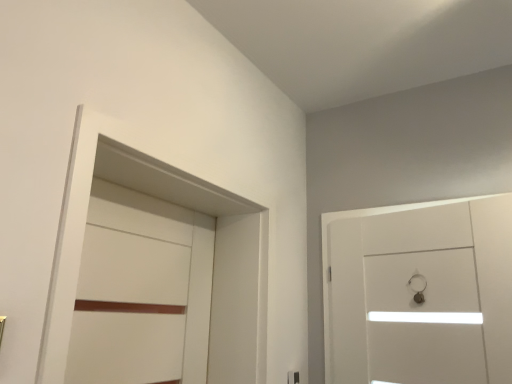
Question: Can you confirm if white glossy door at right, the 2th door in the left-to-right sequence, is bigger than white matte door at left, which ranks as the 1th door in left-to-right order?

Choices:
 (A) yes
 (B) no

Answer: (A)

Question: Can you confirm if white glossy door at right, the first door positioned from the right, is thinner than white matte door at left, arranged as the second door when viewed from the right?

Choices:
 (A) no
 (B) yes

Answer: (A)

Question: Considering the relative sizes of white glossy door at right, the first door positioned from the right, and white matte door at left, which ranks as the 1th door in left-to-right order, in the image provided, is white glossy door at right, the first door positioned from the right, wider than white matte door at left, which ranks as the 1th door in left-to-right order,?

Choices:
 (A) no
 (B) yes

Answer: (B)

Question: Is white glossy door at right, the 2th door in the left-to-right sequence, behind white matte door at left, which ranks as the 1th door in left-to-right order?

Choices:
 (A) yes
 (B) no

Answer: (A)

Question: From the image's perspective, is white glossy door at right, the 2th door in the left-to-right sequence, below white matte door at left, which ranks as the 1th door in left-to-right order?

Choices:
 (A) yes
 (B) no

Answer: (A)

Question: Can white matte door at left, arranged as the second door when viewed from the right, be found inside white glossy door at right, the first door positioned from the right?

Choices:
 (A) yes
 (B) no

Answer: (B)

Question: Can you confirm if white matte door at left, arranged as the second door when viewed from the right, is thinner than white glossy door at right, the 2th door in the left-to-right sequence?

Choices:
 (A) yes
 (B) no

Answer: (A)

Question: From the image's perspective, is white matte door at left, which ranks as the 1th door in left-to-right order, located beneath white glossy door at right, the first door positioned from the right?

Choices:
 (A) yes
 (B) no

Answer: (B)

Question: Are white matte door at left, which ranks as the 1th door in left-to-right order, and white glossy door at right, the first door positioned from the right, located far from each other?

Choices:
 (A) yes
 (B) no

Answer: (B)

Question: Is white matte door at left, arranged as the second door when viewed from the right, positioned beyond the bounds of white glossy door at right, the first door positioned from the right?

Choices:
 (A) yes
 (B) no

Answer: (A)

Question: Is white matte door at left, arranged as the second door when viewed from the right, wider than white glossy door at right, the 2th door in the left-to-right sequence?

Choices:
 (A) yes
 (B) no

Answer: (B)

Question: Is white matte door at left, which ranks as the 1th door in left-to-right order, oriented towards white glossy door at right, the 2th door in the left-to-right sequence?

Choices:
 (A) no
 (B) yes

Answer: (B)

Question: Does white matte locker at left come in front of white glossy door at right, the first door positioned from the right?

Choices:
 (A) yes
 (B) no

Answer: (A)